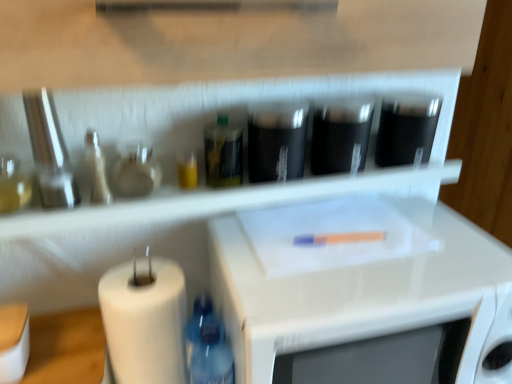
Question: From a real-world perspective, is blue plastic bottle at lower left, positioned as the first bottle in bottom-to-top order, physically located above or below black glossy cups at center, marked as the 2th appliance in a left-to-right arrangement?

Choices:
 (A) above
 (B) below

Answer: (B)

Question: Considering the positions of blue plastic bottle at lower left, the second bottle in the left-to-right sequence, and black glossy cups at center, arranged as the third appliance when viewed from the right, in the image, is blue plastic bottle at lower left, the second bottle in the left-to-right sequence, wider or thinner than black glossy cups at center, arranged as the third appliance when viewed from the right,?

Choices:
 (A) thin
 (B) wide

Answer: (A)

Question: Which object is the farthest from the metallic silver knife set at left, marked as the 1th appliance in a left-to-right arrangement?

Choices:
 (A) translucent glass bottle at center, placed as the third bottle when sorted from left to right
 (B) blue plastic bottle at lower left, the second bottle viewed from the right
 (C) white glossy microwave at center
 (D) black matte container at upper right, placed as the 4th appliance when sorted from left to right
 (E) white matte paper towel at lower left

Answer: (D)

Question: Considering the real-world distances, which object is farthest from the black matte container at upper right, placed as the 4th appliance when sorted from left to right?

Choices:
 (A) black glossy cups at center, arranged as the third appliance when viewed from the right
 (B) translucent glass bottle at left, positioned as the second bottle in bottom-to-top order
 (C) transparent plastic shelf at upper center
 (D) metallic silver knife set at left, marked as the 1th appliance in a left-to-right arrangement
 (E) white matte paper towel at lower left

Answer: (D)